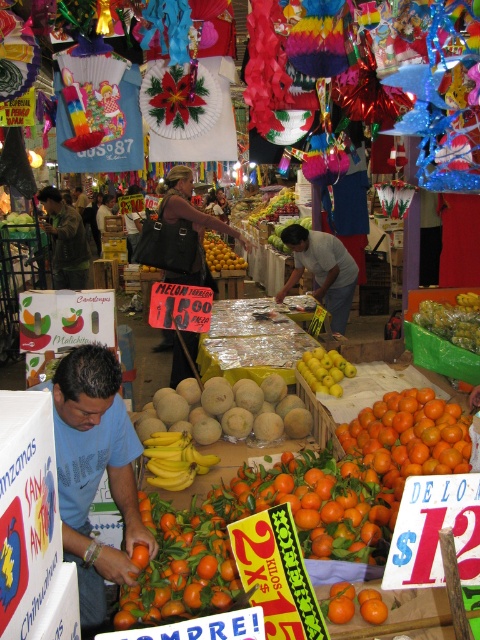
You are a customer at the market and want to buy the orange matte tomato at center. There is a green fabric jacket at center in the way. Can you easily reach the tomato without moving the jacket?

The green fabric jacket at center is above the orange matte tomato at center, so you can reach the tomato without moving the jacket since it is below the jacket.

You are standing at the market entrance and want to reach the fruit stand at point (79, 269). Can you walk directly to it without any obstacles? The path is clear if the distance is less than 30 feet.

The distance between you and the fruit stand at point (79, 269) is 27.07 feet, which is less than 30 feet. Therefore, you can walk directly to it without obstacles.